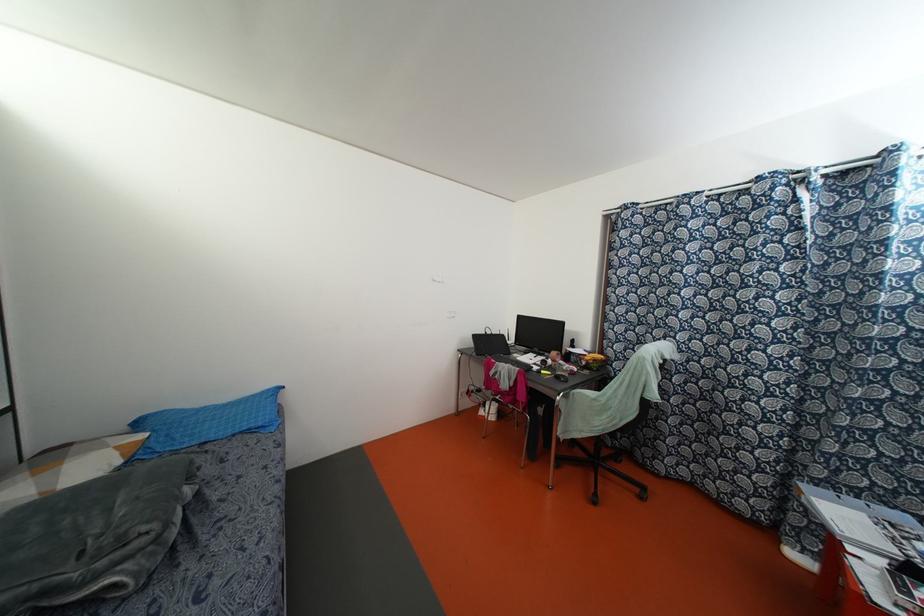
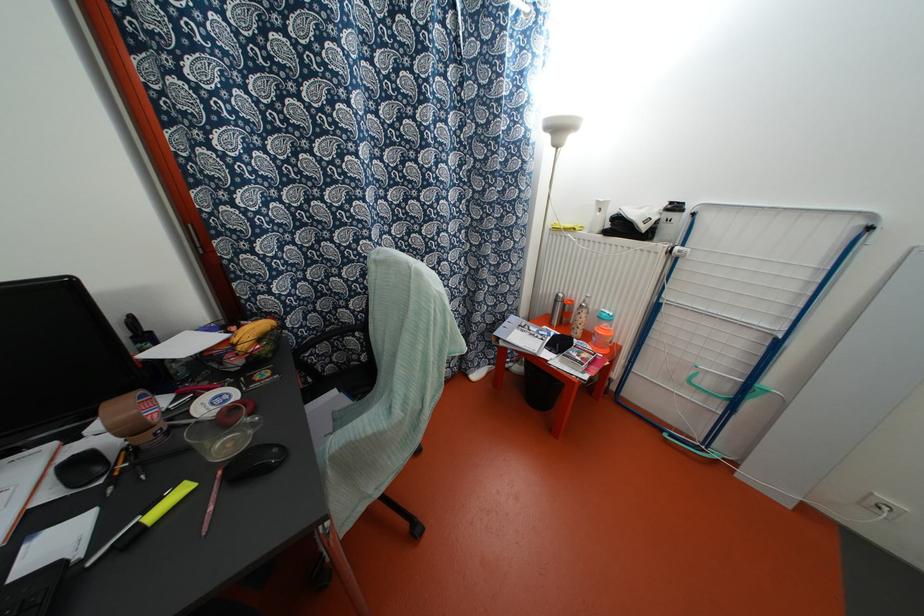
Where in the second image is the point corresponding to (x=553, y=360) from the first image?

(131, 429)